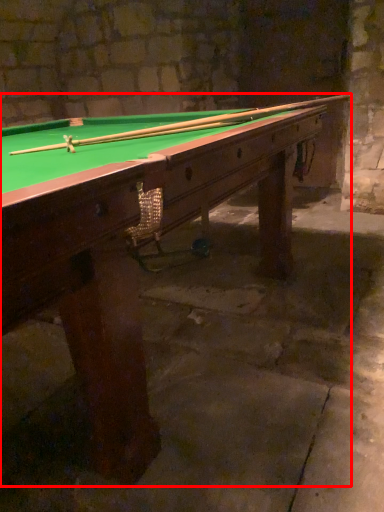
Question: Considering the relative positions of billiard table (annotated by the red box) and cue in the image provided, where is billiard table (annotated by the red box) located with respect to the staircase?

Choices:
 (A) left
 (B) right

Answer: (A)